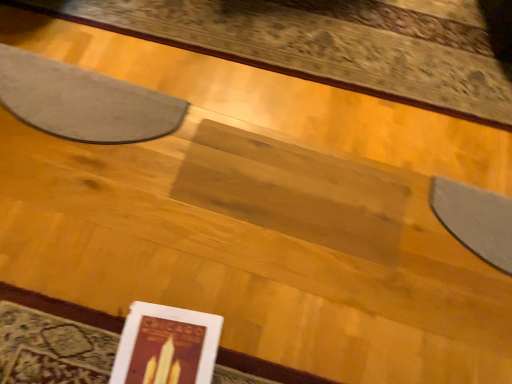
Question: Can you confirm if matte paper book at lower left is bigger than gray felt mat at upper left?

Choices:
 (A) no
 (B) yes

Answer: (A)

Question: Is matte paper book at lower left not inside gray felt mat at upper left?

Choices:
 (A) no
 (B) yes

Answer: (B)

Question: Is matte paper book at lower left smaller than gray felt mat at upper left?

Choices:
 (A) yes
 (B) no

Answer: (A)

Question: Is matte paper book at lower left facing towards gray felt mat at upper left?

Choices:
 (A) no
 (B) yes

Answer: (A)

Question: Is the surface of matte paper book at lower left in direct contact with gray felt mat at upper left?

Choices:
 (A) yes
 (B) no

Answer: (B)

Question: Can you confirm if matte paper book at lower left is thinner than gray felt mat at upper left?

Choices:
 (A) yes
 (B) no

Answer: (B)

Question: Is gray felt mat at upper left turned away from matte paper book at lower left?

Choices:
 (A) yes
 (B) no

Answer: (B)

Question: Can you confirm if gray felt mat at upper left is wider than matte paper book at lower left?

Choices:
 (A) no
 (B) yes

Answer: (A)

Question: From a real-world perspective, is gray felt mat at upper left below matte paper book at lower left?

Choices:
 (A) no
 (B) yes

Answer: (B)

Question: Is matte paper book at lower left located within gray felt mat at upper left?

Choices:
 (A) no
 (B) yes

Answer: (A)

Question: Does gray felt mat at upper left lie in front of matte paper book at lower left?

Choices:
 (A) no
 (B) yes

Answer: (A)

Question: Is gray felt mat at upper left with matte paper book at lower left?

Choices:
 (A) yes
 (B) no

Answer: (B)

Question: Looking at the image, does gray felt mat at upper left seem bigger or smaller compared to matte paper book at lower left?

Choices:
 (A) big
 (B) small

Answer: (A)